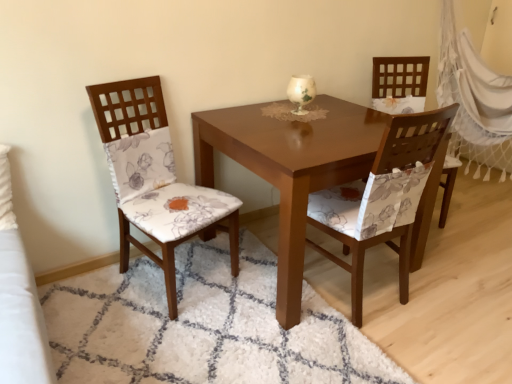
The image size is (512, 384). I want to click on white net curtain at right, so click(474, 101).

Locate an element on the screen. white ceramic vase at center is located at coordinates coord(301,92).

From the image's perspective, is wooden chair with floral cushion at left, which is counted as the third chair, starting from the right, below matte floral fabric chair at center, which is the second chair in right-to-left order?

Actually, wooden chair with floral cushion at left, which is counted as the third chair, starting from the right, appears above matte floral fabric chair at center, which is the second chair in right-to-left order, in the image.

Based on their positions, is wooden chair with floral cushion at left, positioned as the first chair in left-to-right order, located to the left or right of matte floral fabric chair at center, which is the second chair in right-to-left order?

From the image, it's evident that wooden chair with floral cushion at left, positioned as the first chair in left-to-right order, is to the left of matte floral fabric chair at center, which is the second chair in right-to-left order.

Between point (166, 136) and point (394, 155), which one is positioned in front?

Positioned in front is point (394, 155).

Between wooden chair with floral cushion at left, positioned as the first chair in left-to-right order, and matte floral fabric chair at center, placed as the 2th chair when sorted from left to right, which one is positioned in front?

matte floral fabric chair at center, placed as the 2th chair when sorted from left to right.

Looking at their sizes, would you say white ceramic vase at center is wider or thinner than wooden chair with floral cushion at left, positioned as the first chair in left-to-right order?

Clearly, white ceramic vase at center has less width compared to wooden chair with floral cushion at left, positioned as the first chair in left-to-right order.

Is white ceramic vase at center far from wooden chair with floral cushion at left, positioned as the first chair in left-to-right order?

They are positioned close to each other.

From a real-world perspective, is white ceramic vase at center physically below wooden chair with floral cushion at left, positioned as the first chair in left-to-right order?

No, from a real-world perspective, white ceramic vase at center is not below wooden chair with floral cushion at left, positioned as the first chair in left-to-right order.

Based on the photo, can you confirm if white ceramic vase at center is smaller than wooden chair with floral cushion at left, which is counted as the third chair, starting from the right?

Correct, white ceramic vase at center occupies less space than wooden chair with floral cushion at left, which is counted as the third chair, starting from the right.

Which of these two, floral fabric chair at right, which is the 1th chair from right to left, or wooden chair with floral cushion at left, which is counted as the third chair, starting from the right, is bigger?

Bigger between the two is wooden chair with floral cushion at left, which is counted as the third chair, starting from the right.

From a real-world perspective, between floral fabric chair at right, which is the 1th chair from right to left, and wooden chair with floral cushion at left, positioned as the first chair in left-to-right order, who is vertically higher?

wooden chair with floral cushion at left, positioned as the first chair in left-to-right order, from a real-world perspective.

Is floral fabric chair at right, placed as the 3th chair when sorted from left to right, positioned with its back to wooden chair with floral cushion at left, positioned as the first chair in left-to-right order?

That's not correct — floral fabric chair at right, placed as the 3th chair when sorted from left to right, is not looking away from wooden chair with floral cushion at left, positioned as the first chair in left-to-right order.

Considering the positions of objects floral fabric chair at right, which is the 1th chair from right to left, and wooden chair with floral cushion at left, positioned as the first chair in left-to-right order, in the image provided, who is more to the left, floral fabric chair at right, which is the 1th chair from right to left, or wooden chair with floral cushion at left, positioned as the first chair in left-to-right order,?

Positioned to the left is wooden chair with floral cushion at left, positioned as the first chair in left-to-right order.

Who is shorter, matte floral fabric chair at center, which is the second chair in right-to-left order, or white net curtain at right?

Standing shorter between the two is matte floral fabric chair at center, which is the second chair in right-to-left order.

Which of these two, matte floral fabric chair at center, which is the second chair in right-to-left order, or white net curtain at right, is smaller?

With smaller size is matte floral fabric chair at center, which is the second chair in right-to-left order.

From a real-world perspective, which is physically above, matte floral fabric chair at center, which is the second chair in right-to-left order, or white net curtain at right?

white net curtain at right.

Which point is more distant from viewer, (127, 354) or (390, 78)?

The point (390, 78) is farther from the camera.

How different are the orientations of white shaggy rug at center and floral fabric chair at right, which is the 1th chair from right to left, in degrees?

The facing directions of white shaggy rug at center and floral fabric chair at right, which is the 1th chair from right to left, are 113 degrees apart.

From the image's perspective, which one is positioned lower, white shaggy rug at center or floral fabric chair at right, placed as the 3th chair when sorted from left to right?

white shaggy rug at center, from the image's perspective.

Where is `mat directly beneath the floral fabric chair at right, placed as the 3th chair when sorted from left to right (from a real-world perspective)`? The width and height of the screenshot is (512, 384). mat directly beneath the floral fabric chair at right, placed as the 3th chair when sorted from left to right (from a real-world perspective) is located at coordinates (203, 326).

Choose the correct answer: Is white net curtain at right inside wooden chair with floral cushion at left, which is counted as the third chair, starting from the right, or outside it?

white net curtain at right is spatially situated outside wooden chair with floral cushion at left, which is counted as the third chair, starting from the right.

What's the angular difference between white net curtain at right and wooden chair with floral cushion at left, positioned as the first chair in left-to-right order,'s facing directions?

63.8 degrees separate the facing orientations of white net curtain at right and wooden chair with floral cushion at left, positioned as the first chair in left-to-right order.

Is white net curtain at right directly adjacent to wooden chair with floral cushion at left, positioned as the first chair in left-to-right order?

white net curtain at right is not next to wooden chair with floral cushion at left, positioned as the first chair in left-to-right order, and they're not touching.

Does point (468, 55) lie in front of point (446, 108)?

That is False.

Identify the location of curtain behind the matte floral fabric chair at center, placed as the 2th chair when sorted from left to right. This screenshot has width=512, height=384. (474, 101).

Is white net curtain at right closer to camera compared to matte floral fabric chair at center, placed as the 2th chair when sorted from left to right?

No, it is not.

Between white net curtain at right and matte floral fabric chair at center, which is the second chair in right-to-left order, which one has less height?

Standing shorter between the two is matte floral fabric chair at center, which is the second chair in right-to-left order.

The image size is (512, 384). Find the location of `chair on the left side of matte floral fabric chair at center, placed as the 2th chair when sorted from left to right`. chair on the left side of matte floral fabric chair at center, placed as the 2th chair when sorted from left to right is located at coordinates (156, 179).

Find the location of a particular element. This screenshot has height=384, width=512. the 1st chair positioned below the white ceramic vase at center (from a real-world perspective) is located at coordinates (156, 179).

Which object lies further to the anchor point white ceramic vase at center, floral fabric chair at right, which is the 1th chair from right to left, or white net curtain at right?

white net curtain at right lies further to white ceramic vase at center than the other object.

Estimate the real-world distances between objects in this image. Which object is closer to floral fabric chair at right, placed as the 3th chair when sorted from left to right, wooden chair with floral cushion at left, which is counted as the third chair, starting from the right, or matte floral fabric chair at center, placed as the 2th chair when sorted from left to right?

The object closer to floral fabric chair at right, placed as the 3th chair when sorted from left to right, is matte floral fabric chair at center, placed as the 2th chair when sorted from left to right.

From the image, which object appears to be nearer to floral fabric chair at right, placed as the 3th chair when sorted from left to right, white ceramic vase at center or matte floral fabric chair at center, which is the second chair in right-to-left order?

Based on the image, matte floral fabric chair at center, which is the second chair in right-to-left order, appears to be nearer to floral fabric chair at right, placed as the 3th chair when sorted from left to right.

Which object lies nearer to the anchor point white net curtain at right, white shaggy rug at center or floral fabric chair at right, which is the 1th chair from right to left?

Based on the image, floral fabric chair at right, which is the 1th chair from right to left, appears to be nearer to white net curtain at right.

When comparing their distances from wooden chair with floral cushion at left, positioned as the first chair in left-to-right order, does floral fabric chair at right, placed as the 3th chair when sorted from left to right, or white ceramic vase at center seem closer?

white ceramic vase at center is positioned closer to the anchor wooden chair with floral cushion at left, positioned as the first chair in left-to-right order.

Based on their spatial positions, is white net curtain at right or floral fabric chair at right, placed as the 3th chair when sorted from left to right, closer to white ceramic vase at center?

Among the two, floral fabric chair at right, placed as the 3th chair when sorted from left to right, is located nearer to white ceramic vase at center.

Which object lies nearer to the anchor point white net curtain at right, wooden chair with floral cushion at left, which is counted as the third chair, starting from the right, or white ceramic vase at center?

white ceramic vase at center lies closer to white net curtain at right than the other object.

From the image, which object appears to be nearer to white shaggy rug at center, white net curtain at right or floral fabric chair at right, placed as the 3th chair when sorted from left to right?

The object closer to white shaggy rug at center is floral fabric chair at right, placed as the 3th chair when sorted from left to right.

Where is `candle holder situated between wooden chair with floral cushion at left, which is counted as the third chair, starting from the right, and floral fabric chair at right, which is the 1th chair from right to left, from left to right`? candle holder situated between wooden chair with floral cushion at left, which is counted as the third chair, starting from the right, and floral fabric chair at right, which is the 1th chair from right to left, from left to right is located at coordinates [x=301, y=92].

I want to click on chair between wooden chair with floral cushion at left, positioned as the first chair in left-to-right order, and floral fabric chair at right, which is the 1th chair from right to left, so click(x=409, y=150).

What are the coordinates of `chair located between white shaggy rug at center and floral fabric chair at right, placed as the 3th chair when sorted from left to right, in the left-right direction` in the screenshot? It's located at (409, 150).

Where is `candle holder between white shaggy rug at center and floral fabric chair at right, which is the 1th chair from right to left, from front to back`? candle holder between white shaggy rug at center and floral fabric chair at right, which is the 1th chair from right to left, from front to back is located at coordinates (301, 92).